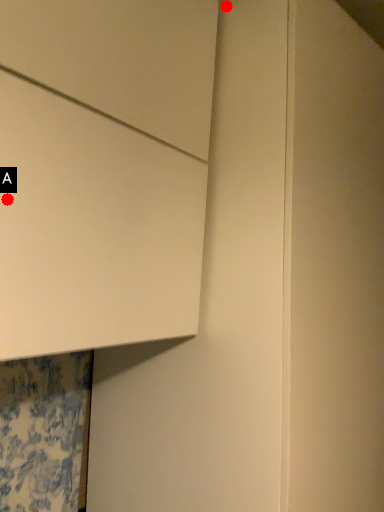
Question: Two points are circled on the image, labeled by A and B beside each circle. Which point is farther from the camera taking this photo?

Choices:
 (A) A is further
 (B) B is further

Answer: (B)